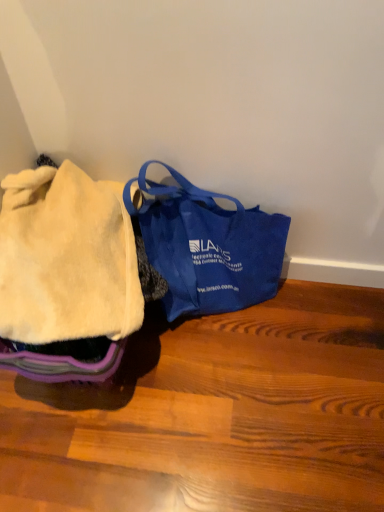
Locate an element on the screen. The image size is (384, 512). free point to the right of blue canvas bag at center is located at coordinates (327, 331).